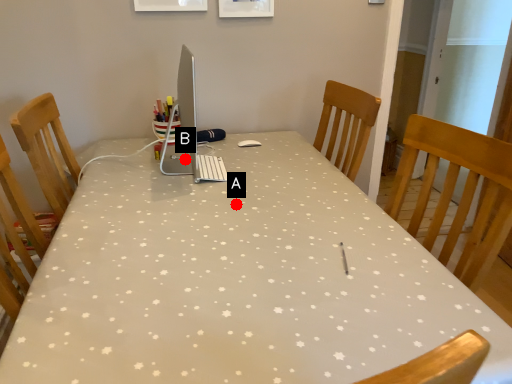
Question: Two points are circled on the image, labeled by A and B beside each circle. Among these points, which one is nearest to the camera?

Choices:
 (A) A is closer
 (B) B is closer

Answer: (A)